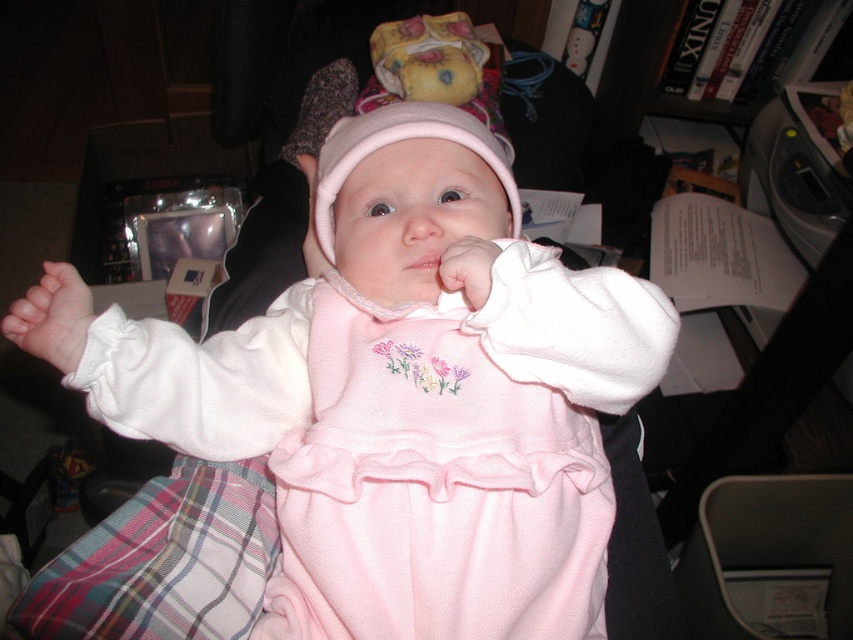
Question: In this image, where is pink fabric hat at center located relative to pink soft fabric hand at center?

Choices:
 (A) left
 (B) right

Answer: (B)

Question: Which point is farther to the camera?

Choices:
 (A) pink soft fabric hand at center
 (B) pink fabric hand at center

Answer: (A)

Question: Estimate the real-world distances between objects in this image. Which object is closer to the pink cotton dress at center?

Choices:
 (A) pink fabric hat at center
 (B) pink fabric hand at center

Answer: (B)

Question: Among these points, which one is farthest from the camera?

Choices:
 (A) (405, 72)
 (B) (596, 376)

Answer: (A)

Question: Does pink cotton dress at center appear on the left side of pink fabric hat at center?

Choices:
 (A) no
 (B) yes

Answer: (B)

Question: Does pink fabric hat at center appear on the left side of pink soft fabric hand at center?

Choices:
 (A) yes
 (B) no

Answer: (B)